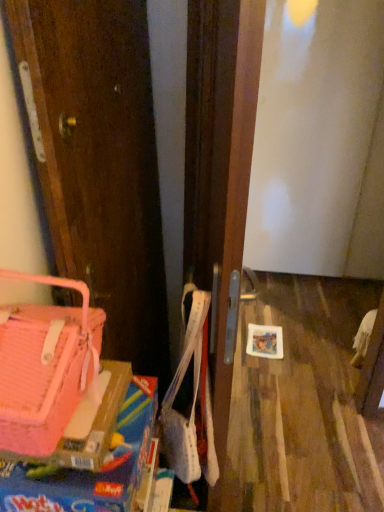
The image size is (384, 512). In order to click on free point above pink plastic box at lower left (from a real-world perspective) in this screenshot , I will do pos(91,452).